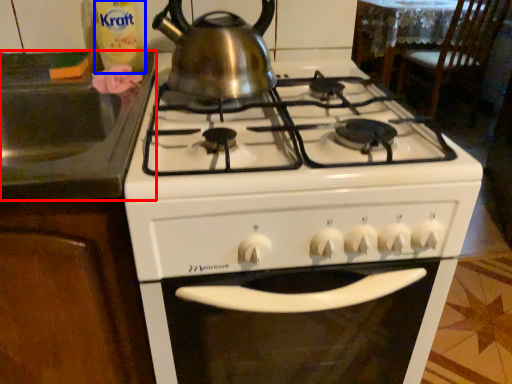
Question: Which point is closer to the camera, sink (highlighted by a red box) or bottle (highlighted by a blue box)?

Choices:
 (A) sink
 (B) bottle

Answer: (A)